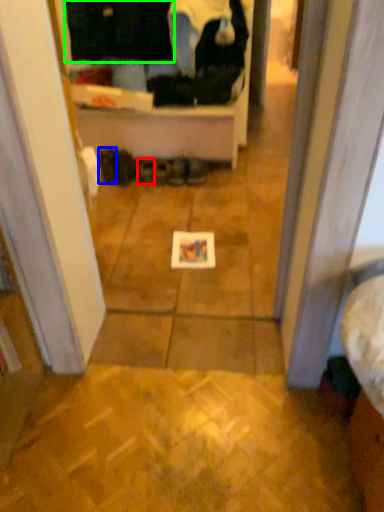
Question: Estimate the real-world distances between objects in this image. Which object is closer to footwear (highlighted by a red box), footwear (highlighted by a blue box) or clothing (highlighted by a green box)?

Choices:
 (A) footwear
 (B) clothing

Answer: (A)